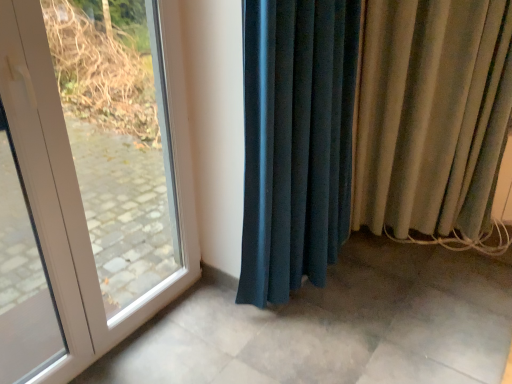
Question: Considering the relative sizes of white glossy door at left and beige velvet curtain at right, the second curtain from the left, in the image provided, is white glossy door at left smaller than beige velvet curtain at right, the second curtain from the left,?

Choices:
 (A) yes
 (B) no

Answer: (A)

Question: Can you confirm if white glossy door at left is wider than beige velvet curtain at right, which is the first curtain from right to left?

Choices:
 (A) yes
 (B) no

Answer: (B)

Question: From the image's perspective, is white glossy door at left above beige velvet curtain at right, the second curtain from the left?

Choices:
 (A) yes
 (B) no

Answer: (B)

Question: Could you tell me if white glossy door at left is facing beige velvet curtain at right, which is the first curtain from right to left?

Choices:
 (A) yes
 (B) no

Answer: (B)

Question: Considering the relative positions of white glossy door at left and beige velvet curtain at right, which is the first curtain from right to left, in the image provided, is white glossy door at left to the right of beige velvet curtain at right, which is the first curtain from right to left, from the viewer's perspective?

Choices:
 (A) no
 (B) yes

Answer: (A)

Question: Which is correct: velvet teal curtain at center, the 2th curtain viewed from the right, is inside beige velvet curtain at right, the second curtain from the left, or outside of it?

Choices:
 (A) outside
 (B) inside

Answer: (A)

Question: Considering the positions of point (245, 251) and point (459, 195), is point (245, 251) closer or farther from the camera than point (459, 195)?

Choices:
 (A) closer
 (B) farther

Answer: (A)

Question: From the image's perspective, is velvet teal curtain at center, the 2th curtain viewed from the right, above or below beige velvet curtain at right, the second curtain from the left?

Choices:
 (A) above
 (B) below

Answer: (B)

Question: Would you say velvet teal curtain at center, the 2th curtain viewed from the right, is to the left or to the right of beige velvet curtain at right, the second curtain from the left, in the picture?

Choices:
 (A) left
 (B) right

Answer: (A)

Question: From a real-world perspective, is white glossy door at left physically located above or below beige velvet curtain at right, the second curtain from the left?

Choices:
 (A) below
 (B) above

Answer: (B)

Question: Would you say white glossy door at left is to the left or to the right of beige velvet curtain at right, the second curtain from the left, in the picture?

Choices:
 (A) right
 (B) left

Answer: (B)

Question: Is white glossy door at left in front of or behind beige velvet curtain at right, which is the first curtain from right to left, in the image?

Choices:
 (A) front
 (B) behind

Answer: (A)

Question: Looking at the image, does white glossy door at left seem bigger or smaller compared to beige velvet curtain at right, the second curtain from the left?

Choices:
 (A) small
 (B) big

Answer: (A)

Question: Is beige velvet curtain at right, which is the first curtain from right to left, to the left or to the right of white glossy door at left in the image?

Choices:
 (A) right
 (B) left

Answer: (A)

Question: Is beige velvet curtain at right, which is the first curtain from right to left, in front of or behind white glossy door at left in the image?

Choices:
 (A) front
 (B) behind

Answer: (B)